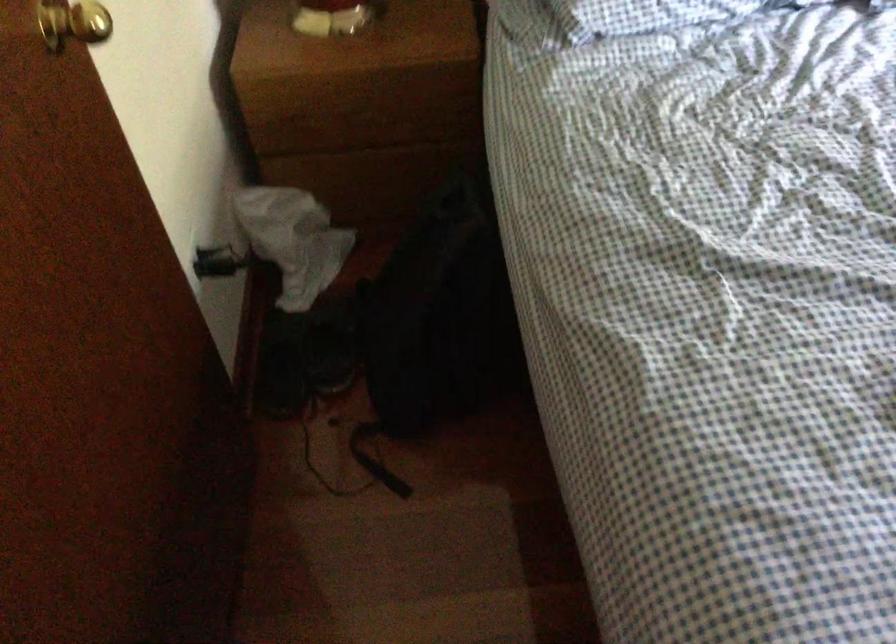
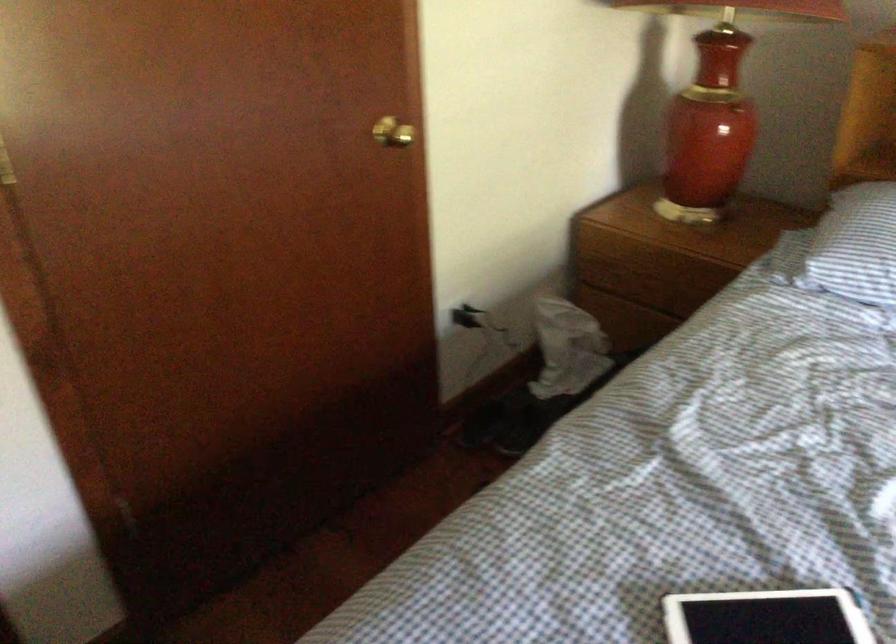
Locate, in the second image, the point that corresponds to the point at 362,122 in the first image.

(650, 283)